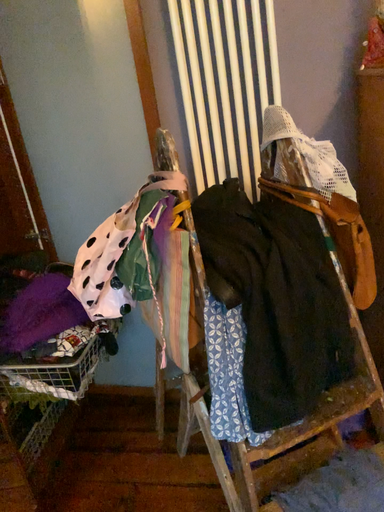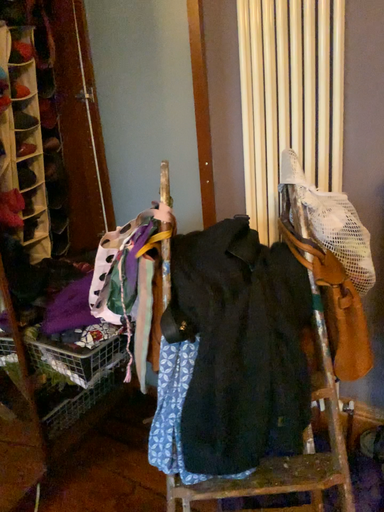
Question: Which way did the camera rotate in the video?

Choices:
 (A) rotated right
 (B) rotated left

Answer: (B)